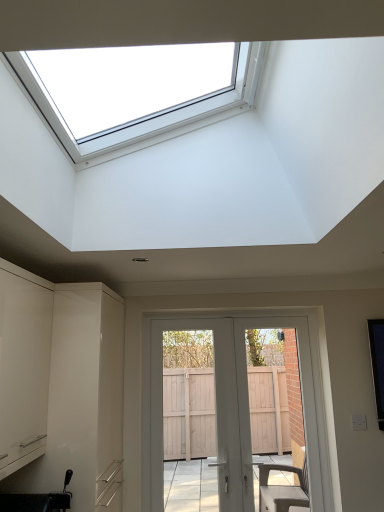
Question: Is white matte cabinet at left, the second cabinetry viewed from the back, oriented towards white glossy cabinet at left, the second cabinetry in the front-to-back sequence?

Choices:
 (A) no
 (B) yes

Answer: (A)

Question: Is white matte cabinet at left, which is the 1th cabinetry from front to back, positioned with its back to white glossy cabinet at left, the second cabinetry in the front-to-back sequence?

Choices:
 (A) no
 (B) yes

Answer: (A)

Question: Can you confirm if white matte cabinet at left, which is the 1th cabinetry from front to back, is wider than white glossy cabinet at left, placed as the 1th cabinetry when sorted from back to front?

Choices:
 (A) no
 (B) yes

Answer: (A)

Question: From a real-world perspective, is white matte cabinet at left, the second cabinetry viewed from the back, physically below white glossy cabinet at left, placed as the 1th cabinetry when sorted from back to front?

Choices:
 (A) yes
 (B) no

Answer: (B)

Question: Can you confirm if white matte cabinet at left, the second cabinetry viewed from the back, is bigger than white glossy cabinet at left, placed as the 1th cabinetry when sorted from back to front?

Choices:
 (A) yes
 (B) no

Answer: (B)

Question: Considering the relative sizes of white matte cabinet at left, the second cabinetry viewed from the back, and white glossy cabinet at left, placed as the 1th cabinetry when sorted from back to front, in the image provided, is white matte cabinet at left, the second cabinetry viewed from the back, thinner than white glossy cabinet at left, placed as the 1th cabinetry when sorted from back to front,?

Choices:
 (A) yes
 (B) no

Answer: (A)

Question: Can you confirm if white matte cabinet at left, the second cabinetry viewed from the back, is wider than white glossy door at center?

Choices:
 (A) no
 (B) yes

Answer: (B)

Question: Is white matte cabinet at left, the second cabinetry viewed from the back, positioned with its back to white glossy door at center?

Choices:
 (A) no
 (B) yes

Answer: (A)

Question: Can you confirm if white matte cabinet at left, the second cabinetry viewed from the back, is positioned to the left of white glossy door at center?

Choices:
 (A) yes
 (B) no

Answer: (A)

Question: Can you confirm if white matte cabinet at left, the second cabinetry viewed from the back, is smaller than white glossy door at center?

Choices:
 (A) yes
 (B) no

Answer: (B)

Question: From the image's perspective, is white matte cabinet at left, the second cabinetry viewed from the back, over white glossy door at center?

Choices:
 (A) yes
 (B) no

Answer: (A)

Question: Is white matte cabinet at left, the second cabinetry viewed from the back, bigger than white glossy door at center?

Choices:
 (A) no
 (B) yes

Answer: (B)

Question: Does white glossy door at center have a greater height compared to black plastic sink at lower left?

Choices:
 (A) no
 (B) yes

Answer: (B)